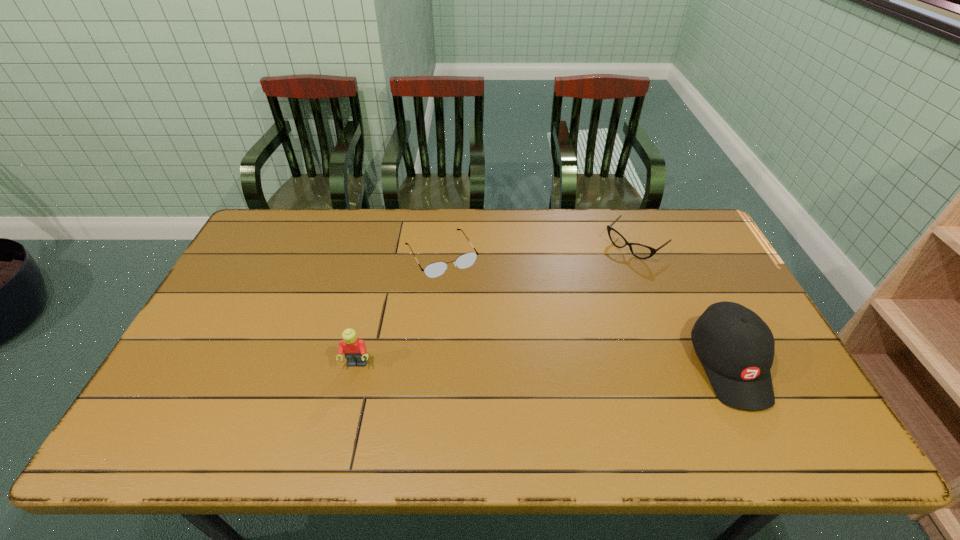
Find the location of a particular element. object that is the closest one to the leftmost object is located at coordinates (436, 269).

You are a GUI agent. You are given a task and a screenshot of the screen. Output one action in this format:
    pyautogui.click(x=<x>, y=<y>)
    Task: Click on the free spot that satisfies the following two spatial constraints: 1. on the back side of the left spectacles; 2. on the left side of the right spectacles
    This screenshot has width=960, height=540.
    Given the screenshot: What is the action you would take?
    pyautogui.click(x=443, y=246)